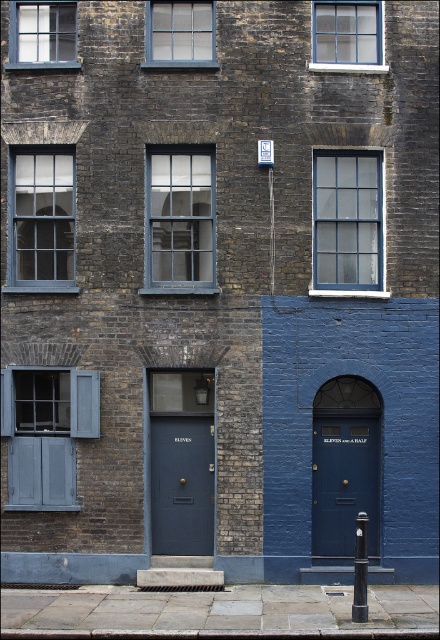
Between matte blue door at center and matte dark blue door at center, which one is positioned lower?

Positioned lower is matte dark blue door at center.

The width and height of the screenshot is (440, 640). I want to click on matte blue door at center, so click(x=344, y=481).

Looking at this image, can you confirm if matte blue door at center is positioned below matte glass window at upper center?

Yes, matte blue door at center is below matte glass window at upper center.

Is matte blue door at center thinner than matte glass window at upper center?

Yes, matte blue door at center is thinner than matte glass window at upper center.

Does point (340, 493) come in front of point (165, 22)?

Yes, point (340, 493) is closer to viewer.

The height and width of the screenshot is (640, 440). Find the location of `matte blue door at center`. matte blue door at center is located at coordinates (344, 481).

Describe the element at coordinates (41, 442) in the screenshot. This screenshot has width=440, height=640. I see `matte gray shutters at left` at that location.

The image size is (440, 640). I want to click on matte gray shutters at left, so click(41, 442).

Where is `matte gray shutters at left`? matte gray shutters at left is located at coordinates (41, 442).